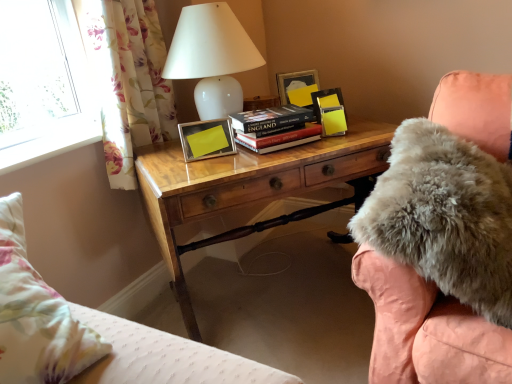
This screenshot has width=512, height=384. What do you see at coordinates (326, 100) in the screenshot?
I see `yellow matte picture frame at upper right, the 2th picture frame in the front-to-back sequence` at bounding box center [326, 100].

At what (x,y) coordinates should I click in order to perform the action: click on yellow matte picture frame at upper right, which is counted as the 2th picture frame, starting from the left. Please return your answer as a coordinate pair (x, y). The width and height of the screenshot is (512, 384). Looking at the image, I should click on (326, 100).

What do you see at coordinates (426, 330) in the screenshot?
I see `fuzzy pink chair at right` at bounding box center [426, 330].

Identify the location of white glossy table lamp at upper center. The width and height of the screenshot is (512, 384). (213, 50).

From the picture: Is floral fabric curtain at left facing towards yellow matte picture frame at upper right, positioned as the 1th picture frame in right-to-left order?

Yes, floral fabric curtain at left is oriented towards yellow matte picture frame at upper right, positioned as the 1th picture frame in right-to-left order.

From a real-world perspective, between floral fabric curtain at left and yellow matte picture frame at upper right, positioned as the 1th picture frame in right-to-left order, who is vertically lower?

In real-world perspective, yellow matte picture frame at upper right, positioned as the 1th picture frame in right-to-left order, is lower.

Which is farther from the camera, (120, 106) or (314, 93)?

The point (314, 93) is farther.

Can you tell me how much metallic silver picture frame at center, which is the 1th picture frame in bottom-to-top order, and wooden desk at center differ in facing direction?

metallic silver picture frame at center, which is the 1th picture frame in bottom-to-top order, and wooden desk at center are facing 8.03 degrees away from each other.

Is metallic silver picture frame at center, the 1th picture frame from the front, inside or outside of wooden desk at center?

metallic silver picture frame at center, the 1th picture frame from the front, is outside wooden desk at center.

In terms of height, does metallic silver picture frame at center, the 2th picture frame in the back-to-front sequence, look taller or shorter compared to wooden desk at center?

In the image, metallic silver picture frame at center, the 2th picture frame in the back-to-front sequence, appears to be shorter than wooden desk at center.

The width and height of the screenshot is (512, 384). Identify the location of curtain on the left of the metallic silver picture frame at center, which is the 1th picture frame in bottom-to-top order. click(129, 81).

Would you say floral fabric curtain at left is part of metallic silver picture frame at center, the 2th picture frame in the back-to-front sequence,'s contents?

Definitely not — floral fabric curtain at left is not inside metallic silver picture frame at center, the 2th picture frame in the back-to-front sequence.

From the image's perspective, which is above, metallic silver picture frame at center, marked as the second picture frame in a top-to-bottom arrangement, or floral fabric curtain at left?

From the image's view, floral fabric curtain at left is above.

Which object is further away from the camera taking this photo, metallic silver picture frame at center, marked as the second picture frame in a top-to-bottom arrangement, or floral fabric curtain at left?

Positioned behind is metallic silver picture frame at center, marked as the second picture frame in a top-to-bottom arrangement.

Is floral fabric curtain at left in contact with white glossy table lamp at upper center?

There is a gap between floral fabric curtain at left and white glossy table lamp at upper center.

Is point (114, 180) positioned before point (204, 65)?

That is False.

Identify the location of curtain below the white glossy table lamp at upper center (from a real-world perspective). Image resolution: width=512 pixels, height=384 pixels. (129, 81).

From the image's perspective, which one is positioned lower, floral fabric curtain at left or white glossy table lamp at upper center?

From the image's view, floral fabric curtain at left is below.

Would you consider floral fabric curtain at left to be distant from hardcover book at center?

No, floral fabric curtain at left is not far from hardcover book at center.

From a real-world perspective, which is physically above, floral fabric curtain at left or hardcover book at center?

In real-world perspective, floral fabric curtain at left is above.

Between floral fabric curtain at left and hardcover book at center, which one has smaller width?

With smaller width is floral fabric curtain at left.

Does point (113, 41) come behind point (301, 123)?

That is False.

Is hardcover book at center beside wooden desk at center?

There is a gap between hardcover book at center and wooden desk at center.

Is wooden desk at center surrounded by hardcover book at center?

No, wooden desk at center is not a part of hardcover book at center.

From a real-world perspective, does hardcover book at center stand above wooden desk at center?

Yes, from a real-world perspective, hardcover book at center is above wooden desk at center.

Is white glossy table lamp at upper center inside yellow matte picture frame at upper right, the 2th picture frame in the front-to-back sequence?

Definitely not — white glossy table lamp at upper center is not inside yellow matte picture frame at upper right, the 2th picture frame in the front-to-back sequence.

Between yellow matte picture frame at upper right, positioned as the 1th picture frame in right-to-left order, and white glossy table lamp at upper center, which one appears on the right side from the viewer's perspective?

yellow matte picture frame at upper right, positioned as the 1th picture frame in right-to-left order.

Is yellow matte picture frame at upper right, placed as the second picture frame when sorted from bottom to top, facing away from white glossy table lamp at upper center?

No, white glossy table lamp at upper center is not at the back of yellow matte picture frame at upper right, placed as the second picture frame when sorted from bottom to top.

Who is smaller, yellow matte picture frame at upper right, the first picture frame when ordered from back to front, or white glossy table lamp at upper center?

With smaller size is yellow matte picture frame at upper right, the first picture frame when ordered from back to front.

At what (x,y) coordinates should I click in order to perform the action: click on curtain to the left of yellow matte picture frame at upper right, positioned as the 1th picture frame in right-to-left order. Please return your answer as a coordinate pair (x, y). Looking at the image, I should click on (129, 81).

I want to click on nightstand lying below the metallic silver picture frame at center, marked as the second picture frame in a top-to-bottom arrangement (from the image's perspective), so click(246, 185).

Based on their spatial positions, is yellow matte picture frame at upper right, positioned as the 1th picture frame in right-to-left order, or metallic silver picture frame at center, the 1th picture frame when ordered from left to right, closer to floral fabric curtain at left?

metallic silver picture frame at center, the 1th picture frame when ordered from left to right.

From the image, which object appears to be nearer to floral fabric curtain at left, hardcover book at center or white glossy table lamp at upper center?

white glossy table lamp at upper center.

Estimate the real-world distances between objects in this image. Which object is further from hardcover book at center, floral fabric curtain at left or white glossy table lamp at upper center?

The object further to hardcover book at center is floral fabric curtain at left.

Based on their spatial positions, is wooden desk at center or fuzzy pink chair at right further from white glossy table lamp at upper center?

The object further to white glossy table lamp at upper center is fuzzy pink chair at right.

Estimate the real-world distances between objects in this image. Which object is further from wooden desk at center, yellow matte picture frame at upper right, which is counted as the 2th picture frame, starting from the left, or floral fabric curtain at left?

yellow matte picture frame at upper right, which is counted as the 2th picture frame, starting from the left, is positioned further to the anchor wooden desk at center.

Based on their spatial positions, is metallic silver picture frame at center, marked as the second picture frame in a top-to-bottom arrangement, or yellow matte picture frame at upper right, which is counted as the 2th picture frame, starting from the left, closer to floral fabric curtain at left?

metallic silver picture frame at center, marked as the second picture frame in a top-to-bottom arrangement, is closer to floral fabric curtain at left.

Estimate the real-world distances between objects in this image. Which object is further from yellow matte picture frame at upper right, positioned as the 1th picture frame in right-to-left order, metallic silver picture frame at center, marked as the second picture frame in a top-to-bottom arrangement, or wooden desk at center?

wooden desk at center is further to yellow matte picture frame at upper right, positioned as the 1th picture frame in right-to-left order.

Based on the photo, considering their positions, is floral fabric curtain at left positioned closer to fuzzy pink chair at right than metallic silver picture frame at center, marked as the second picture frame in a top-to-bottom arrangement?

metallic silver picture frame at center, marked as the second picture frame in a top-to-bottom arrangement, lies closer to fuzzy pink chair at right than the other object.

Locate an element on the screen. Image resolution: width=512 pixels, height=384 pixels. nightstand between white glossy table lamp at upper center and fuzzy pink chair at right in the horizontal direction is located at coordinates (246, 185).

The width and height of the screenshot is (512, 384). I want to click on book located between white glossy table lamp at upper center and fuzzy pink chair at right in the left-right direction, so click(274, 127).

Where is `book between white glossy table lamp at upper center and wooden desk at center from top to bottom`? The width and height of the screenshot is (512, 384). book between white glossy table lamp at upper center and wooden desk at center from top to bottom is located at coordinates (274, 127).

At what (x,y) coordinates should I click in order to perform the action: click on picture frame between floral fabric curtain at left and yellow matte picture frame at upper right, the first picture frame when ordered from back to front, from left to right. Please return your answer as a coordinate pair (x, y). This screenshot has width=512, height=384. Looking at the image, I should click on (207, 139).